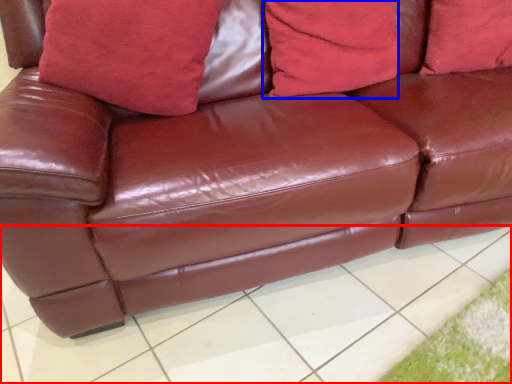
Question: Which of the following is the closest to the observer, tile (highlighted by a red box) or pillow (highlighted by a blue box)?

Choices:
 (A) tile
 (B) pillow

Answer: (A)